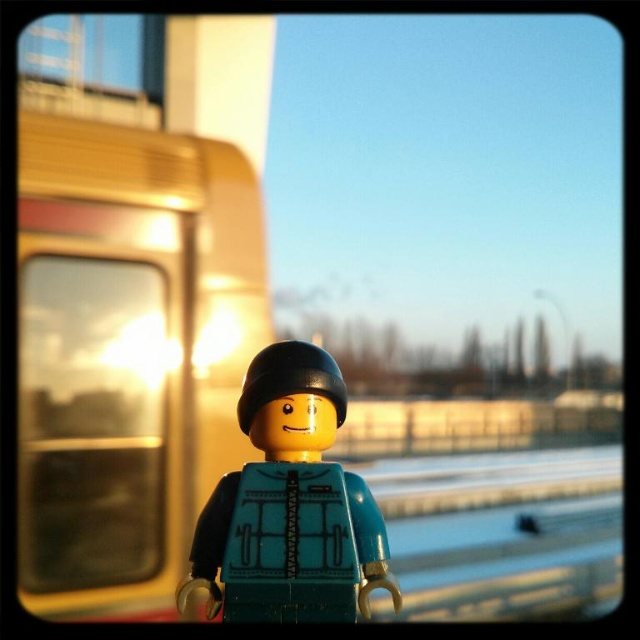
You are a Lego minifigure standing in front of the bus. You notice the metallic gold train at left and the transparent glass train window at left. Which object is closer to you?

The metallic gold train at left is closer to you because it is positioned over the transparent glass train window at left, indicating it is in front.

You are a photographer trying to capture the Lego minifigure and the bus in the best possible way. You notice two points in the scene labeled as point 1 at coordinates point (x=97, y=308) and point 2 at coordinates point (x=44, y=316). Which point is closer to your camera lens?

Point (x=97, y=308) is further to the viewer than point (x=44, y=316), so point (x=44, y=316) is closer to the camera lens.